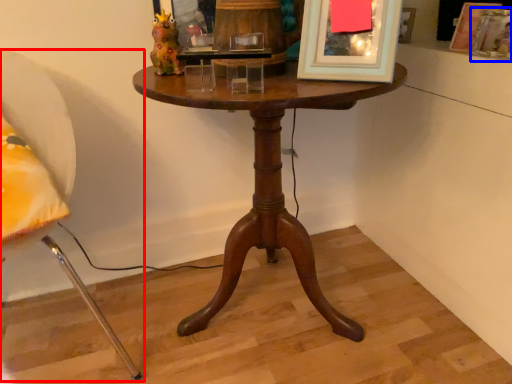
Question: Which of the following is the farthest to the observer, chair (highlighted by a red box) or picture frame (highlighted by a blue box)?

Choices:
 (A) chair
 (B) picture frame

Answer: (B)